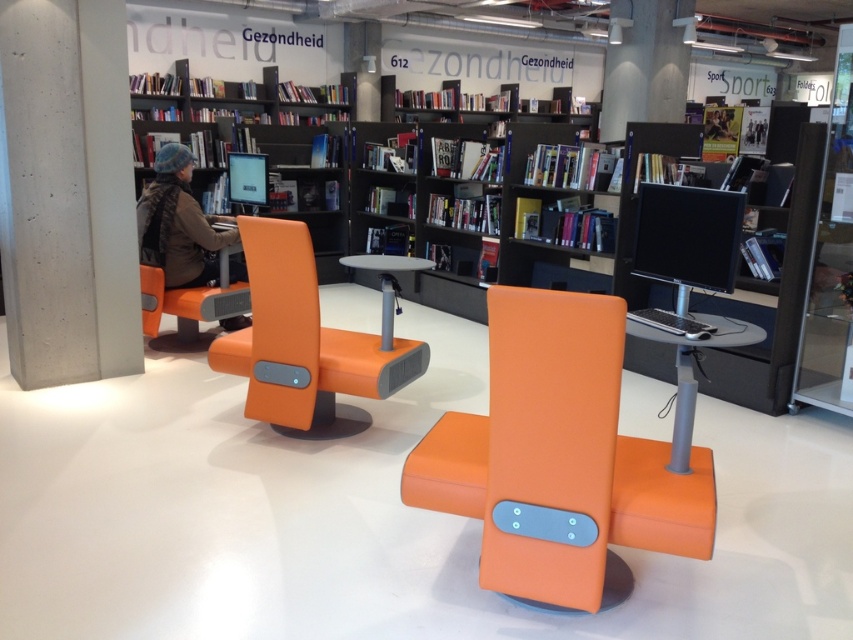
Question: Does orange leather swivel chair at center appear on the left side of matte black monitor at center?

Choices:
 (A) yes
 (B) no

Answer: (A)

Question: Can you confirm if orange leather armchair at center is positioned below matte black monitor at center?

Choices:
 (A) yes
 (B) no

Answer: (A)

Question: Which object appears farthest from the camera in this image?

Choices:
 (A) matte black bookcase at center
 (B) matte black monitor at center
 (C) orange leather armchair at center
 (D) orange leather swivel chair at center

Answer: (A)

Question: Can you confirm if matte black bookshelf at upper left is wider than matte black monitor at center?

Choices:
 (A) no
 (B) yes

Answer: (B)

Question: Which point is farther from the camera taking this photo?

Choices:
 (A) (277, 321)
 (B) (263, 84)
 (C) (665, 196)
 (D) (544, 586)

Answer: (B)

Question: Which point is farther to the camera?

Choices:
 (A) matte black monitor at center
 (B) orange leather swivel chair at center
 (C) matte black bookshelf at upper left
 (D) matte black bookcase at center

Answer: (C)